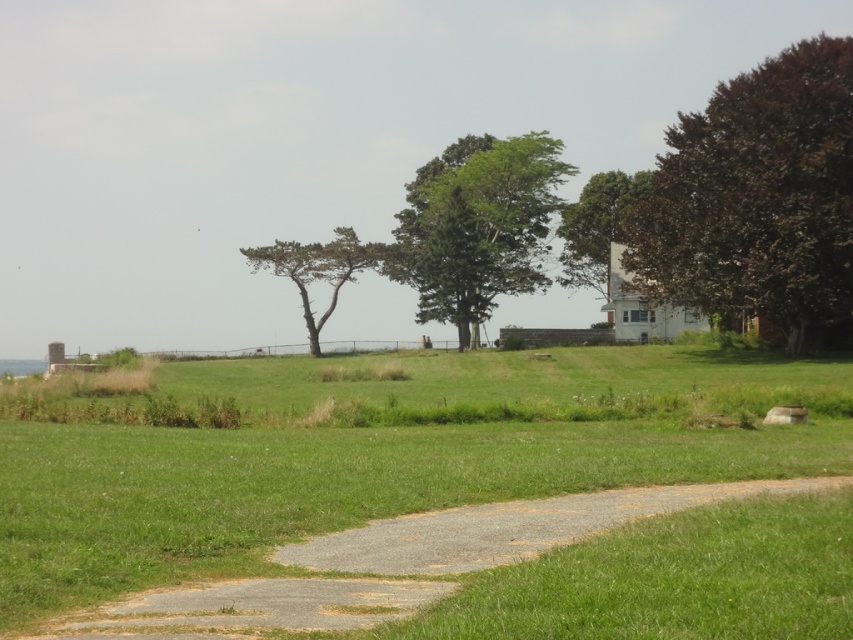
Is point (795, 278) in front of point (509, 160)?

Yes, it is in front of point (509, 160).

Can you confirm if dark brown textured tree at upper right is shorter than green leafy tree at center?

In fact, dark brown textured tree at upper right may be taller than green leafy tree at center.

Find the location of a particular element. Image resolution: width=853 pixels, height=640 pixels. dark brown textured tree at upper right is located at coordinates (756, 196).

Locate an element on the screen. dark brown textured tree at upper right is located at coordinates (756, 196).

Does green leafy tree at center have a larger size compared to green textured tree at center?

Yes.

Can you confirm if green leafy tree at center is shorter than green textured tree at center?

No, green leafy tree at center is not shorter than green textured tree at center.

Who is more forward, (543, 188) or (300, 304)?

Point (543, 188) is more forward.

Find the location of a particular element. The height and width of the screenshot is (640, 853). green leafy tree at center is located at coordinates (477, 225).

Is green grass at center behind green leafy tree at center?

No, green grass at center is in front of green leafy tree at center.

Is green grass at center smaller than green leafy tree at center?

Correct, green grass at center occupies less space than green leafy tree at center.

Find the location of `green grass at center`. green grass at center is located at coordinates (376, 460).